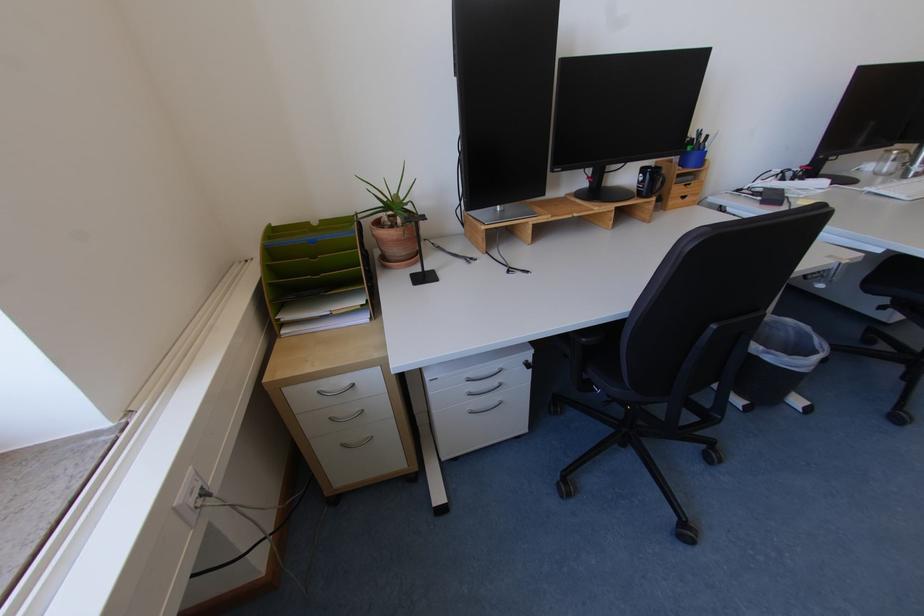
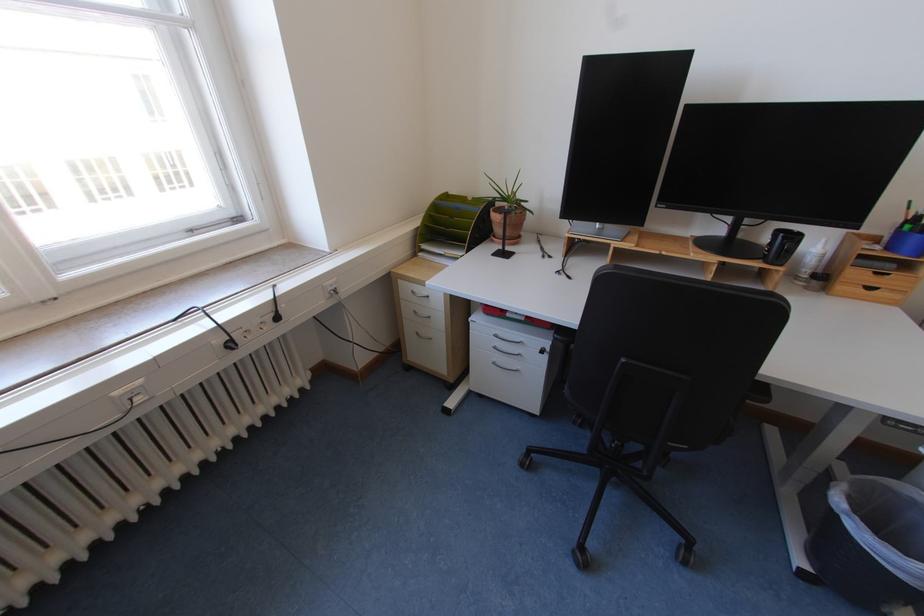
Locate, in the second image, the point that corresponds to [329,222] in the first image.

(481, 199)